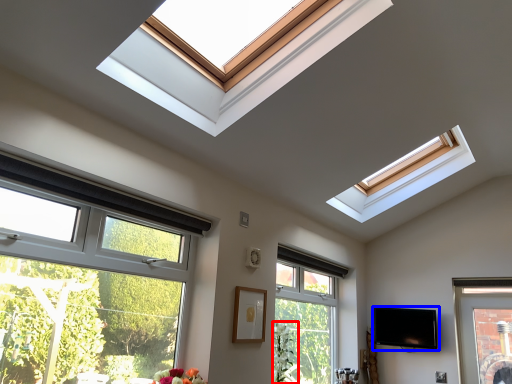
Question: Among these objects, which one is farthest to the camera, plant (highlighted by a red box) or television (highlighted by a blue box)?

Choices:
 (A) plant
 (B) television

Answer: (B)